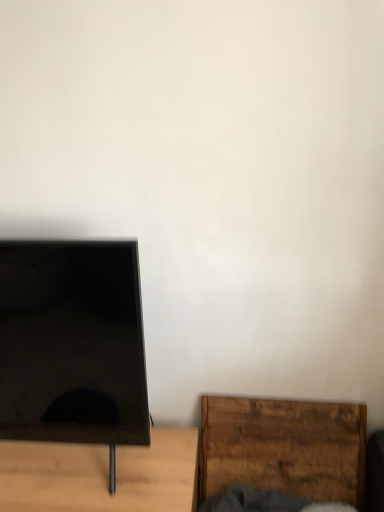
Question: Does black matte tv stand at left, positioned as the 2th furniture in right-to-left order, lie behind wooden cutting board at lower right, positioned as the first furniture in right-to-left order?

Choices:
 (A) yes
 (B) no

Answer: (B)

Question: Considering the relative sizes of black matte tv stand at left, positioned as the 2th furniture in right-to-left order, and wooden cutting board at lower right, the 2th furniture viewed from the left, in the image provided, is black matte tv stand at left, positioned as the 2th furniture in right-to-left order, wider than wooden cutting board at lower right, the 2th furniture viewed from the left,?

Choices:
 (A) yes
 (B) no

Answer: (A)

Question: Can you confirm if black matte tv stand at left, the first furniture viewed from the left, is positioned to the right of wooden cutting board at lower right, positioned as the first furniture in right-to-left order?

Choices:
 (A) yes
 (B) no

Answer: (B)

Question: From a real-world perspective, is black matte tv stand at left, the first furniture viewed from the left, positioned under wooden cutting board at lower right, positioned as the first furniture in right-to-left order, based on gravity?

Choices:
 (A) yes
 (B) no

Answer: (A)

Question: Considering the relative sizes of black matte tv stand at left, positioned as the 2th furniture in right-to-left order, and wooden cutting board at lower right, positioned as the first furniture in right-to-left order, in the image provided, is black matte tv stand at left, positioned as the 2th furniture in right-to-left order, shorter than wooden cutting board at lower right, positioned as the first furniture in right-to-left order,?

Choices:
 (A) no
 (B) yes

Answer: (B)

Question: Are black matte tv stand at left, the first furniture viewed from the left, and wooden cutting board at lower right, positioned as the first furniture in right-to-left order, beside each other?

Choices:
 (A) yes
 (B) no

Answer: (B)

Question: Is wooden cutting board at lower right, positioned as the first furniture in right-to-left order, at the right side of black matte tv stand at left, the first furniture viewed from the left?

Choices:
 (A) yes
 (B) no

Answer: (A)

Question: Are wooden cutting board at lower right, the 2th furniture viewed from the left, and black matte tv stand at left, the first furniture viewed from the left, beside each other?

Choices:
 (A) yes
 (B) no

Answer: (B)

Question: Is wooden cutting board at lower right, positioned as the first furniture in right-to-left order, looking in the opposite direction of black matte tv stand at left, positioned as the 2th furniture in right-to-left order?

Choices:
 (A) no
 (B) yes

Answer: (A)

Question: Can you confirm if wooden cutting board at lower right, positioned as the first furniture in right-to-left order, is smaller than black matte tv stand at left, the first furniture viewed from the left?

Choices:
 (A) yes
 (B) no

Answer: (A)

Question: Could you tell me if wooden cutting board at lower right, positioned as the first furniture in right-to-left order, is turned towards black matte tv stand at left, positioned as the 2th furniture in right-to-left order?

Choices:
 (A) yes
 (B) no

Answer: (B)

Question: Considering the relative sizes of wooden cutting board at lower right, positioned as the first furniture in right-to-left order, and black matte tv stand at left, positioned as the 2th furniture in right-to-left order, in the image provided, is wooden cutting board at lower right, positioned as the first furniture in right-to-left order, wider than black matte tv stand at left, positioned as the 2th furniture in right-to-left order,?

Choices:
 (A) no
 (B) yes

Answer: (A)

Question: Would you say black glossy screen at left contains wooden cutting board at lower right, positioned as the first furniture in right-to-left order?

Choices:
 (A) no
 (B) yes

Answer: (A)